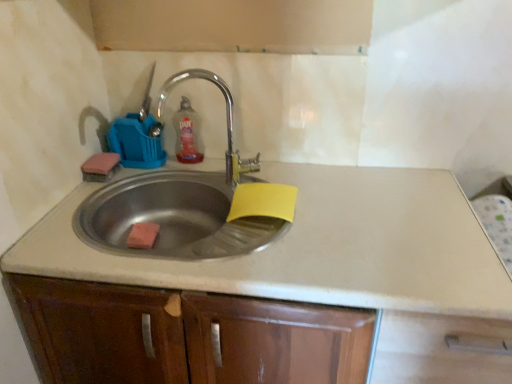
You are a GUI agent. You are given a task and a screenshot of the screen. Output one action in this format:
    pyautogui.click(x=<x>, y=<y>)
    Task: Click on the free space in front of translucent plastic bottle at upper center
    The image size is (512, 384).
    Given the screenshot: What is the action you would take?
    pyautogui.click(x=185, y=174)